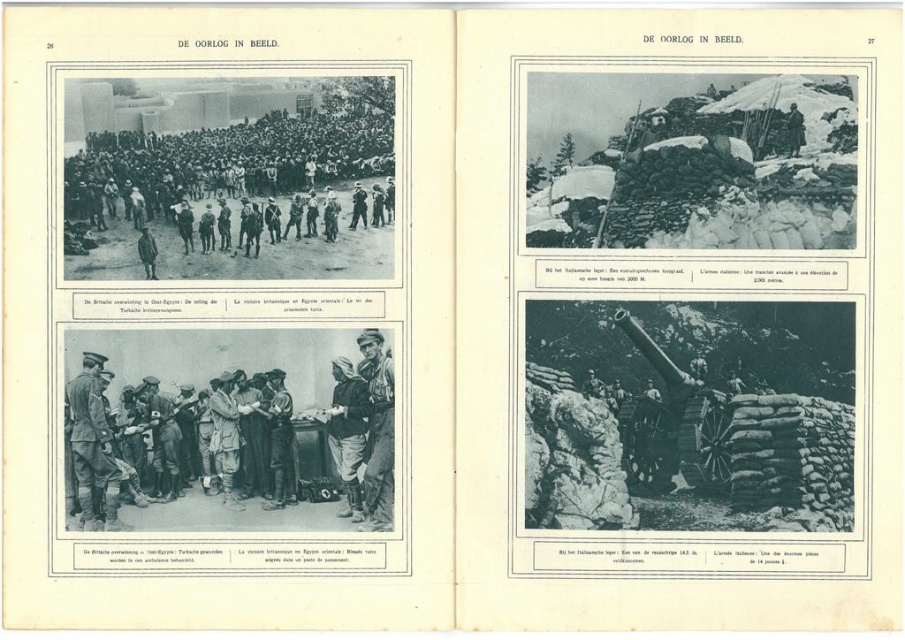
Looking at the bottom image on the left page of the publication, you see a uniformed officer at center and a dark gray uniform at upper center. Which of these two figures is taller?

The uniformed officer at center is taller than the dark gray uniform at upper center.

Based on the scene from the publication, which object takes up more area in the bottom image of the left page? Please refer to the camouflage fabric soldier at center and the camouflage fabric uniform at center.

The camouflage fabric uniform at center takes up more area than the camouflage fabric soldier at center in the bottom image of the left page.